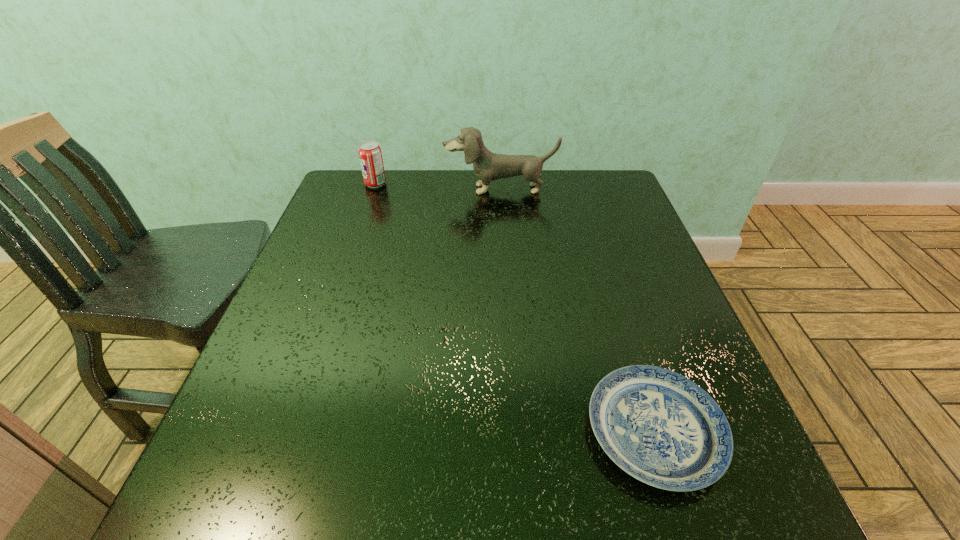
What are the coordinates of `vacant region at the far right corner of the desktop` in the screenshot? It's located at (586, 173).

Where is `free space between the tallest object and the nearest object`? The image size is (960, 540). free space between the tallest object and the nearest object is located at coordinates (577, 310).

You are a GUI agent. You are given a task and a screenshot of the screen. Output one action in this format:
    pyautogui.click(x=<x>, y=<y>)
    Task: Click on the vacant point located between the puppy and the plate
    The height and width of the screenshot is (540, 960).
    Given the screenshot: What is the action you would take?
    pyautogui.click(x=577, y=310)

Image resolution: width=960 pixels, height=540 pixels. What are the coordinates of `free space between the soda can and the nearest object` in the screenshot? It's located at (515, 307).

This screenshot has width=960, height=540. Identify the location of free area in between the plate and the puppy. (577, 310).

Where is `vacant space that's between the puppy and the second shortest object`? Image resolution: width=960 pixels, height=540 pixels. vacant space that's between the puppy and the second shortest object is located at coordinates (438, 186).

What are the coordinates of `free space between the puppy and the leftmost object` in the screenshot? It's located at (438, 186).

This screenshot has height=540, width=960. What are the coordinates of `free space between the second tallest object and the puppy` in the screenshot? It's located at (438, 186).

This screenshot has height=540, width=960. In order to click on free point between the nearest object and the puppy in this screenshot , I will do pos(577,310).

Find the location of `vacant space in between the soda can and the puppy`. vacant space in between the soda can and the puppy is located at coordinates (438, 186).